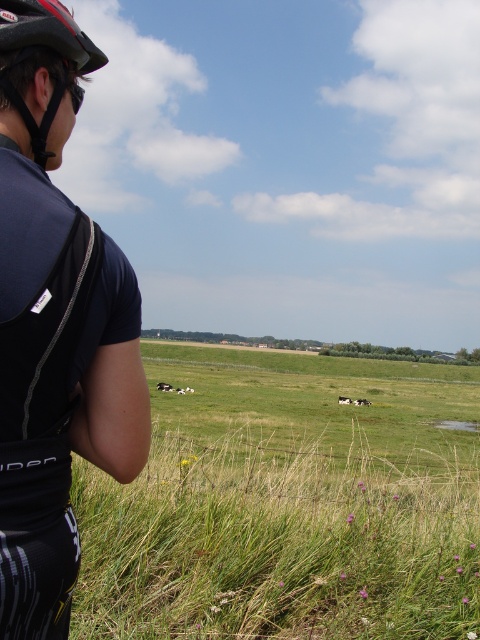
You are a photographer trying to capture a closeup of the matte black cycling jersey at left and the matte black helmet at upper left. Since you want both objects in focus, you need to know which one is closer to you. Can you determine which object is nearer based on their sizes?

The matte black cycling jersey at left is larger in size than the matte black helmet at upper left, which suggests that the matte black cycling jersey at left is closer to you because objects closer to the viewer appear larger.